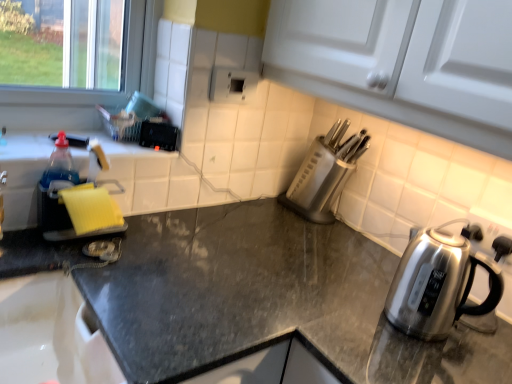
Question: Does black granite countertop at center have a lesser width compared to yellow sponge at left?

Choices:
 (A) no
 (B) yes

Answer: (A)

Question: Would you consider black granite countertop at center to be distant from yellow sponge at left?

Choices:
 (A) no
 (B) yes

Answer: (A)

Question: Is black granite countertop at center taller than yellow sponge at left?

Choices:
 (A) yes
 (B) no

Answer: (A)

Question: From a real-world perspective, is black granite countertop at center positioned under yellow sponge at left based on gravity?

Choices:
 (A) no
 (B) yes

Answer: (B)

Question: Is black granite countertop at center touching yellow sponge at left?

Choices:
 (A) yes
 (B) no

Answer: (B)

Question: Is black granite countertop at center closer to camera compared to yellow sponge at left?

Choices:
 (A) no
 (B) yes

Answer: (B)

Question: Is yellow sponge at left shorter than black granite countertop at center?

Choices:
 (A) no
 (B) yes

Answer: (B)

Question: Considering the relative sizes of yellow sponge at left and black granite countertop at center in the image provided, is yellow sponge at left thinner than black granite countertop at center?

Choices:
 (A) no
 (B) yes

Answer: (B)

Question: Does yellow sponge at left have a larger size compared to black granite countertop at center?

Choices:
 (A) no
 (B) yes

Answer: (A)

Question: Is black granite countertop at center inside yellow sponge at left?

Choices:
 (A) yes
 (B) no

Answer: (B)

Question: From the image's perspective, is yellow sponge at left under black granite countertop at center?

Choices:
 (A) no
 (B) yes

Answer: (A)

Question: From the image's perspective, does yellow sponge at left appear higher than black granite countertop at center?

Choices:
 (A) yes
 (B) no

Answer: (A)

Question: Is satin silver kettle at right further to the viewer compared to black granite countertop at center?

Choices:
 (A) yes
 (B) no

Answer: (A)